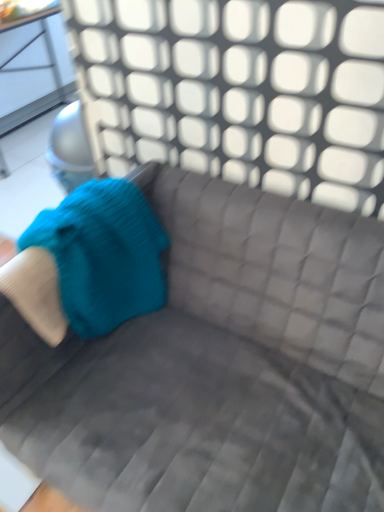
Question: Should I look upward or downward to see teal knitted bean bag chair at left?

Choices:
 (A) down
 (B) up

Answer: (A)

Question: Considering the relative positions of teal knitted bean bag chair at left and velvet gray couch at center in the image provided, is teal knitted bean bag chair at left to the right of velvet gray couch at center from the viewer's perspective?

Choices:
 (A) no
 (B) yes

Answer: (A)

Question: From the image's perspective, is teal knitted bean bag chair at left above velvet gray couch at center?

Choices:
 (A) no
 (B) yes

Answer: (B)

Question: Considering the relative sizes of teal knitted bean bag chair at left and velvet gray couch at center in the image provided, is teal knitted bean bag chair at left taller than velvet gray couch at center?

Choices:
 (A) no
 (B) yes

Answer: (A)

Question: Is teal knitted bean bag chair at left oriented towards velvet gray couch at center?

Choices:
 (A) yes
 (B) no

Answer: (A)

Question: Is teal knitted bean bag chair at left shorter than velvet gray couch at center?

Choices:
 (A) no
 (B) yes

Answer: (B)

Question: Is teal knitted bean bag chair at left not near velvet gray couch at center?

Choices:
 (A) no
 (B) yes

Answer: (A)

Question: Does velvet gray couch at center have a lesser height compared to teal knitted bean bag chair at left?

Choices:
 (A) no
 (B) yes

Answer: (A)

Question: Does velvet gray couch at center have a lesser width compared to teal knitted bean bag chair at left?

Choices:
 (A) yes
 (B) no

Answer: (B)

Question: From the image's perspective, is velvet gray couch at center on top of teal knitted bean bag chair at left?

Choices:
 (A) no
 (B) yes

Answer: (A)

Question: Considering the relative sizes of velvet gray couch at center and teal knitted bean bag chair at left in the image provided, is velvet gray couch at center taller than teal knitted bean bag chair at left?

Choices:
 (A) yes
 (B) no

Answer: (A)

Question: Is velvet gray couch at center at the right side of teal knitted bean bag chair at left?

Choices:
 (A) yes
 (B) no

Answer: (A)

Question: Is velvet gray couch at center aimed at teal knitted bean bag chair at left?

Choices:
 (A) yes
 (B) no

Answer: (B)

Question: Does point (321, 338) appear closer or farther from the camera than point (46, 222)?

Choices:
 (A) farther
 (B) closer

Answer: (A)